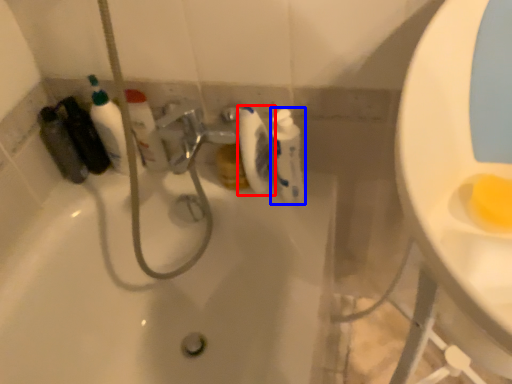
Question: Among these objects, which one is farthest to the camera, toilet paper (highlighted by a red box) or cleaning product (highlighted by a blue box)?

Choices:
 (A) toilet paper
 (B) cleaning product

Answer: (A)